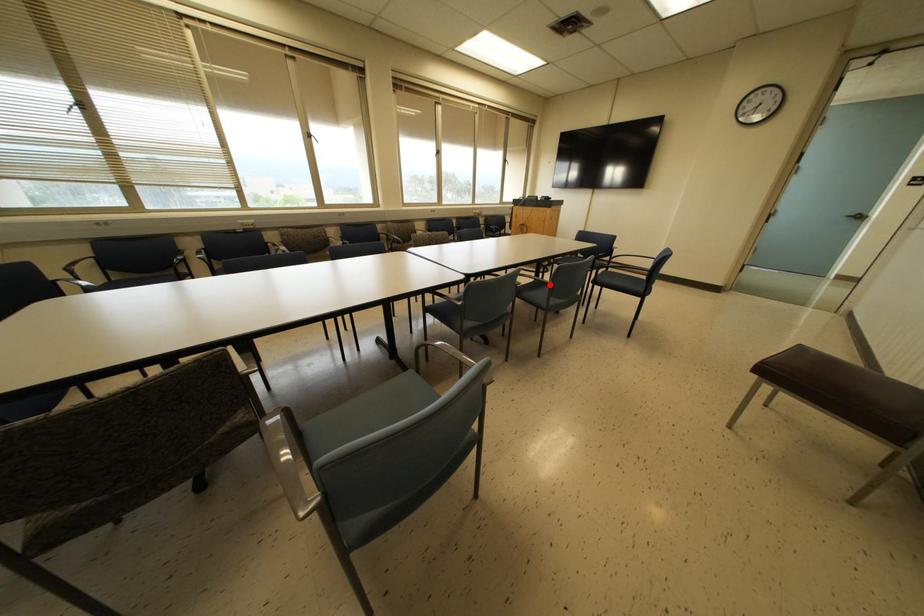
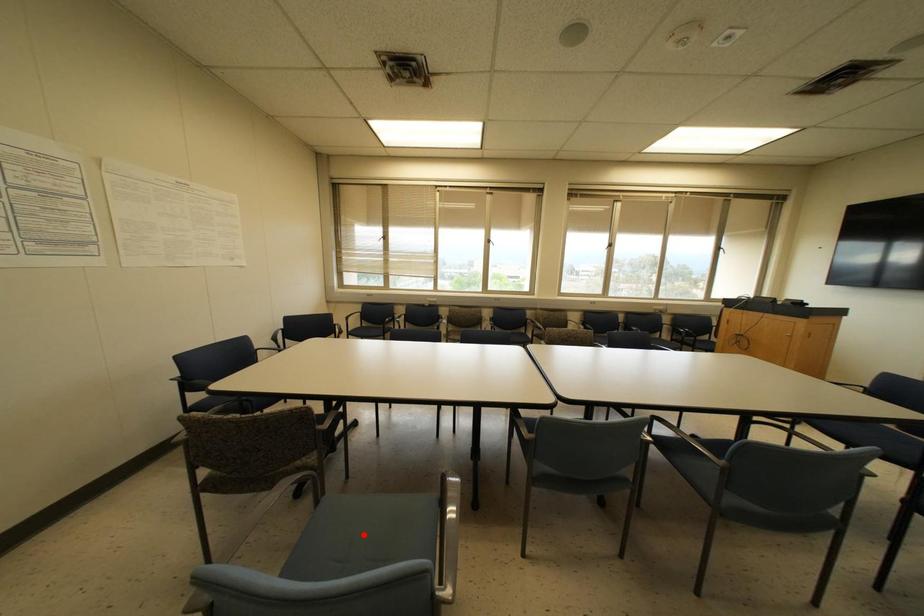
I am providing you with two images of the same scene from different viewpoints. A red point is marked on the first image and another point is marked on the second image. Is the marked point in image1 the same physical position as the marked point in image2?

No